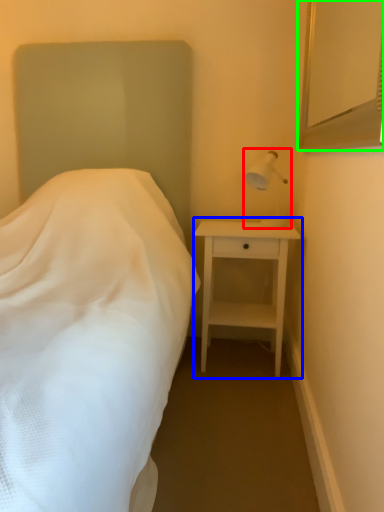
Question: Based on their relative distances, which object is farther from bedside lamp (highlighted by a red box)? Choose from nightstand (highlighted by a blue box) and mirror (highlighted by a green box).

Choices:
 (A) nightstand
 (B) mirror

Answer: (B)